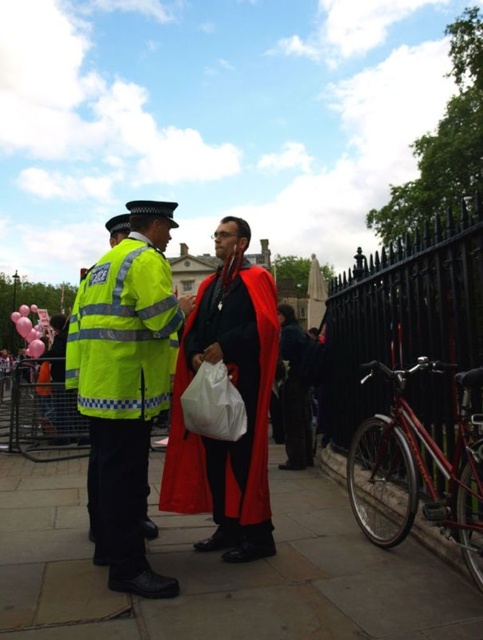
Is point (115, 528) farther from camera compared to point (352, 360)?

No, (115, 528) is in front of (352, 360).

Find the location of a particular element. This screenshot has width=483, height=640. high visibility yellow jacket at left is located at coordinates pos(125,388).

Can you confirm if high visibility yellow jacket at left is positioned above velvet-like red cape at center?

No.

Who is higher up, high visibility yellow jacket at left or velvet-like red cape at center?

velvet-like red cape at center

Locate an element on the screen. Image resolution: width=483 pixels, height=640 pixels. high visibility yellow jacket at left is located at coordinates (125, 388).

Does slate gray stone pavement at center appear under black wrought iron fence at right?

Yes, slate gray stone pavement at center is below black wrought iron fence at right.

Does slate gray stone pavement at center come behind black wrought iron fence at right?

No, slate gray stone pavement at center is closer to the viewer.

Which is behind, point (312, 486) or point (398, 353)?

The point (312, 486) is behind.

Locate an element on the screen. This screenshot has width=483, height=640. slate gray stone pavement at center is located at coordinates (219, 572).